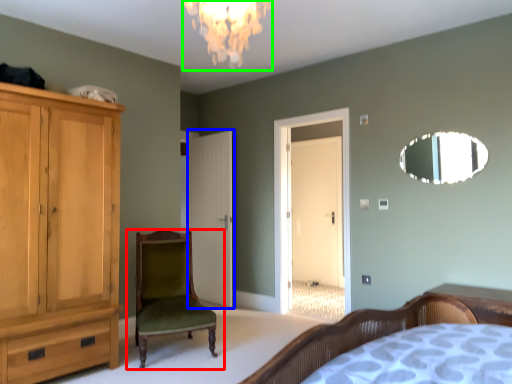
Question: Considering the real-world distances, which object is farthest from chair (highlighted by a red box)? door (highlighted by a blue box) or light fixture (highlighted by a green box)?

Choices:
 (A) door
 (B) light fixture

Answer: (B)